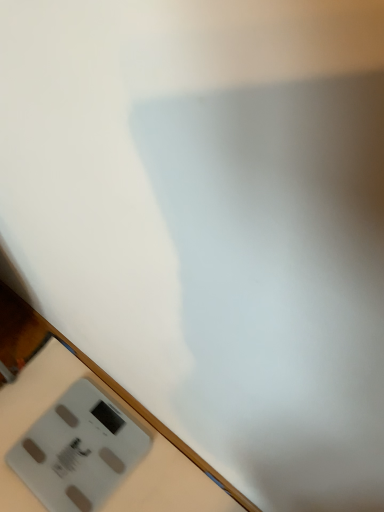
Question: Considering the relative positions of white plastic scale at lower left and gray plastic scale at bottom left in the image provided, is white plastic scale at lower left to the left or to the right of gray plastic scale at bottom left?

Choices:
 (A) left
 (B) right

Answer: (B)

Question: Do you think white plastic scale at lower left is within gray plastic scale at bottom left, or outside of it?

Choices:
 (A) inside
 (B) outside

Answer: (B)

Question: Relative to gray plastic scale at bottom left, is white plastic scale at lower left in front or behind?

Choices:
 (A) front
 (B) behind

Answer: (A)

Question: From the image's perspective, is gray plastic scale at bottom left above or below white plastic scale at lower left?

Choices:
 (A) below
 (B) above

Answer: (B)

Question: Considering the relative positions of gray plastic scale at bottom left and white plastic scale at lower left in the image provided, is gray plastic scale at bottom left to the left or to the right of white plastic scale at lower left?

Choices:
 (A) right
 (B) left

Answer: (B)

Question: Considering the positions of gray plastic scale at bottom left and white plastic scale at lower left in the image, is gray plastic scale at bottom left taller or shorter than white plastic scale at lower left?

Choices:
 (A) tall
 (B) short

Answer: (B)

Question: Does point (86, 476) appear closer or farther from the camera than point (69, 438)?

Choices:
 (A) closer
 (B) farther

Answer: (A)